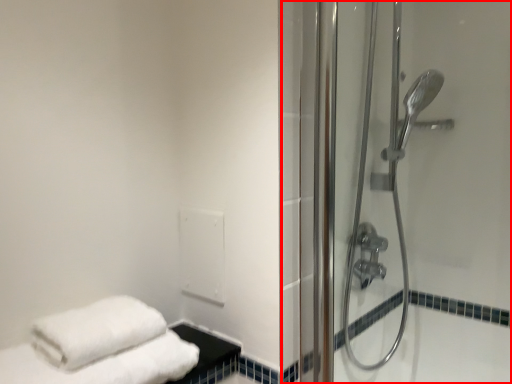
Question: From the image's perspective, what is the correct spatial positioning of shower door (annotated by the red box) in reference to shower door?

Choices:
 (A) below
 (B) above

Answer: (A)